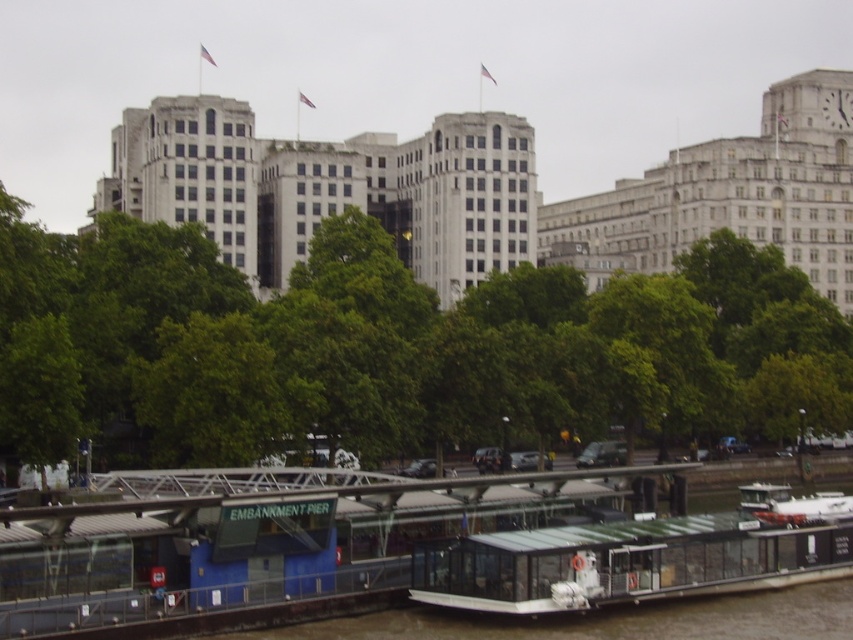
Question: Is green leafy tree at center further to camera compared to transparent glass boat at center?

Choices:
 (A) yes
 (B) no

Answer: (A)

Question: Which object appears farthest from the camera in this image?

Choices:
 (A) green leafy tree at center
 (B) transparent glass boat at center

Answer: (A)

Question: Is green leafy tree at center thinner than transparent glass boat at center?

Choices:
 (A) yes
 (B) no

Answer: (B)

Question: Observing the image, what is the correct spatial positioning of green leafy tree at center in reference to transparent glass boat at center?

Choices:
 (A) above
 (B) below

Answer: (A)